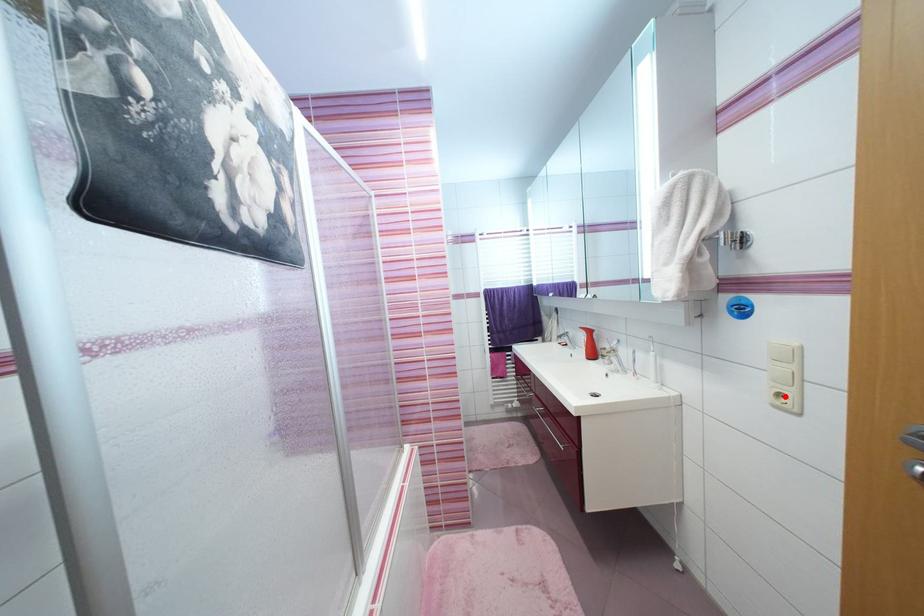
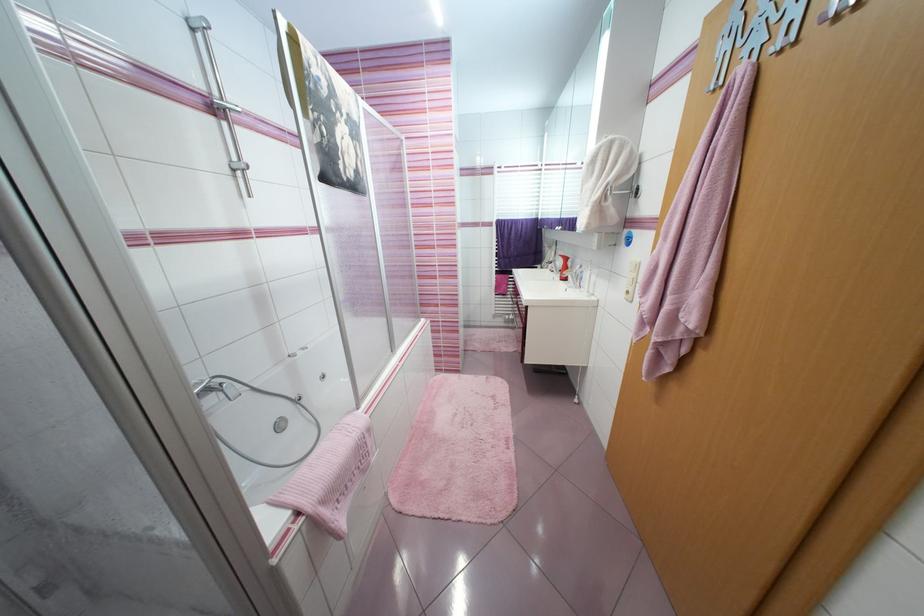
Question: I am providing you with two images of the same scene from different viewpoints. Image1 has a red point marked. In image2, the corresponding 3D location appears at what relative position? Reply with the corresponding letter.

Choices:
 (A) Closer
 (B) Farther

Answer: (A)